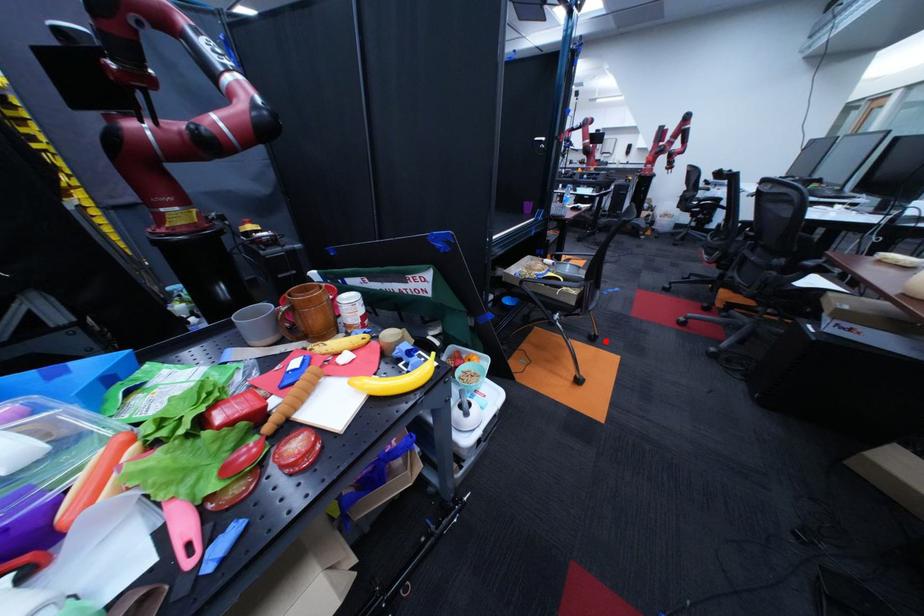
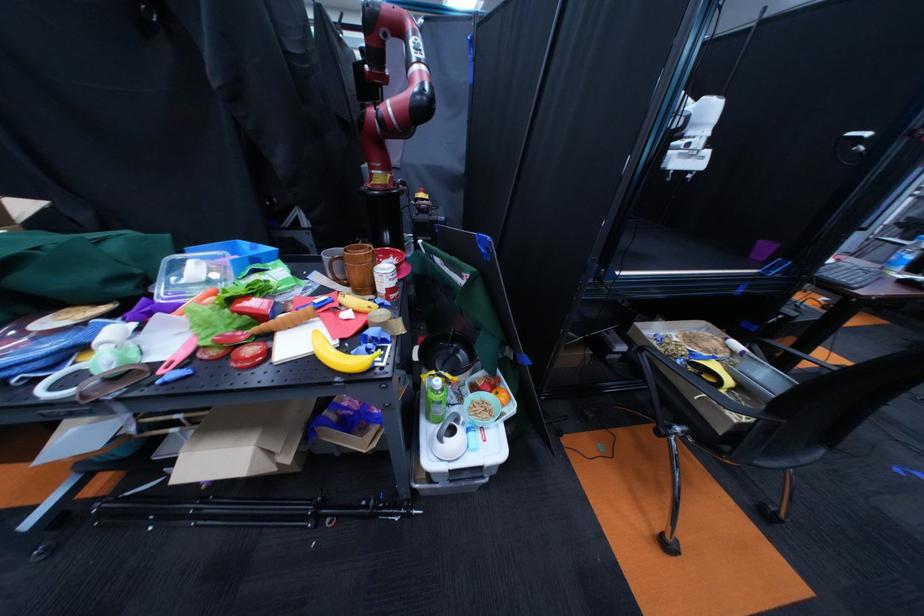
The point at the highlighted location is marked in the first image. Where is the corresponding point in the second image?

(776, 517)